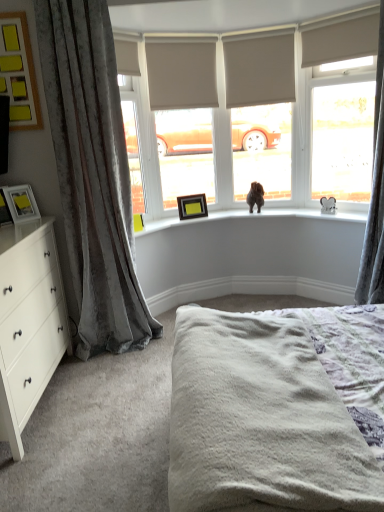
Question: Is matte black picture frame at left, placed as the 2th picture frame when sorted from front to back, further to the viewer compared to velvet gray curtain at left, which is the 2th curtain in right-to-left order?

Choices:
 (A) yes
 (B) no

Answer: (A)

Question: From a real-world perspective, is matte black picture frame at left, placed as the 2th picture frame when sorted from front to back, below velvet gray curtain at left, which is the 2th curtain in right-to-left order?

Choices:
 (A) no
 (B) yes

Answer: (B)

Question: Is matte black picture frame at left, which appears as the first picture frame when ordered from the bottom, shorter than velvet gray curtain at left, which is the 2th curtain in right-to-left order?

Choices:
 (A) yes
 (B) no

Answer: (A)

Question: Does matte black picture frame at left, the fourth picture frame viewed from the top, turn towards velvet gray curtain at left, which is the 2th curtain in right-to-left order?

Choices:
 (A) yes
 (B) no

Answer: (B)

Question: Can you confirm if matte black picture frame at left, which appears as the 1th picture frame when viewed from the left, is thinner than velvet gray curtain at left, the 1th curtain viewed from the left?

Choices:
 (A) yes
 (B) no

Answer: (A)

Question: Considering the positions of beige fabric blind at upper right, positioned as the first blind in right-to-left order, and velvet gray curtain at left, the 1th curtain viewed from the left, in the image, is beige fabric blind at upper right, positioned as the first blind in right-to-left order, wider or thinner than velvet gray curtain at left, the 1th curtain viewed from the left,?

Choices:
 (A) thin
 (B) wide

Answer: (A)

Question: From a real-world perspective, relative to velvet gray curtain at left, which is the 2th curtain in right-to-left order, is beige fabric blind at upper right, positioned as the first blind in right-to-left order, vertically above or below?

Choices:
 (A) above
 (B) below

Answer: (A)

Question: Is beige fabric blind at upper right, positioned as the first blind in right-to-left order, in front of or behind velvet gray curtain at left, the 1th curtain viewed from the left, in the image?

Choices:
 (A) behind
 (B) front

Answer: (A)

Question: Which is correct: beige fabric blind at upper right, placed as the third blind when sorted from left to right, is inside velvet gray curtain at left, which is the 2th curtain in right-to-left order, or outside of it?

Choices:
 (A) inside
 (B) outside

Answer: (B)

Question: Is beige fabric blind at upper right, positioned as the first blind in right-to-left order, inside or outside of yellow matte picture frame at upper left, marked as the 4th picture frame in a back-to-front arrangement?

Choices:
 (A) outside
 (B) inside

Answer: (A)

Question: Considering the positions of point (304, 66) and point (3, 51), is point (304, 66) closer or farther from the camera than point (3, 51)?

Choices:
 (A) farther
 (B) closer

Answer: (A)

Question: Is beige fabric blind at upper right, placed as the third blind when sorted from left to right, taller or shorter than yellow matte picture frame at upper left, marked as the 4th picture frame in a back-to-front arrangement?

Choices:
 (A) short
 (B) tall

Answer: (A)

Question: Considering the positions of beige fabric blind at upper right, positioned as the first blind in right-to-left order, and yellow matte picture frame at upper left, which is the third picture frame in left-to-right order, in the image, is beige fabric blind at upper right, positioned as the first blind in right-to-left order, bigger or smaller than yellow matte picture frame at upper left, which is the third picture frame in left-to-right order,?

Choices:
 (A) big
 (B) small

Answer: (A)

Question: Based on their sizes in the image, would you say brown wooden picture frame at upper center, the third picture frame from the bottom, is bigger or smaller than yellow matte picture frame at upper left, arranged as the 4th picture frame when ordered from the bottom?

Choices:
 (A) small
 (B) big

Answer: (A)

Question: Is point (178, 208) closer or farther from the camera than point (29, 120)?

Choices:
 (A) closer
 (B) farther

Answer: (B)